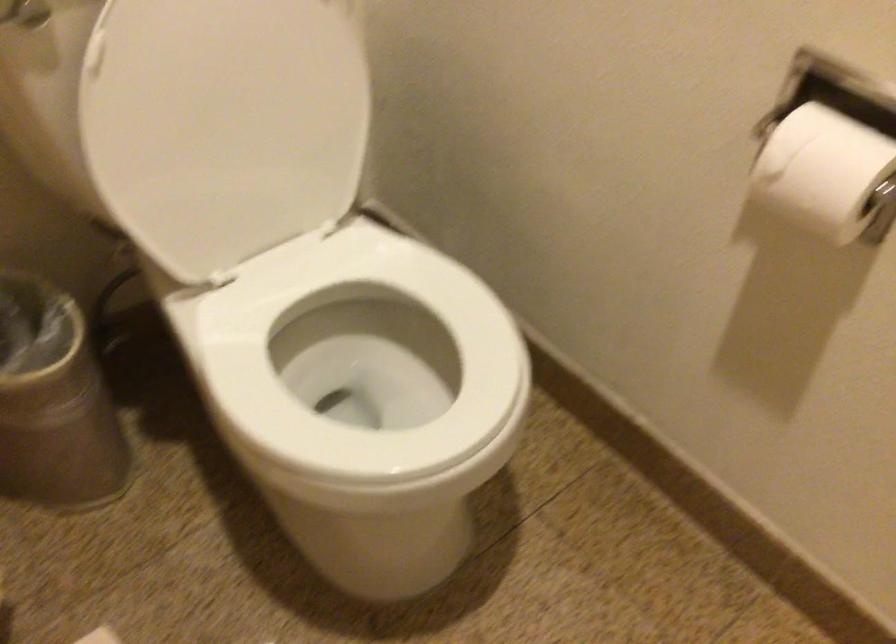
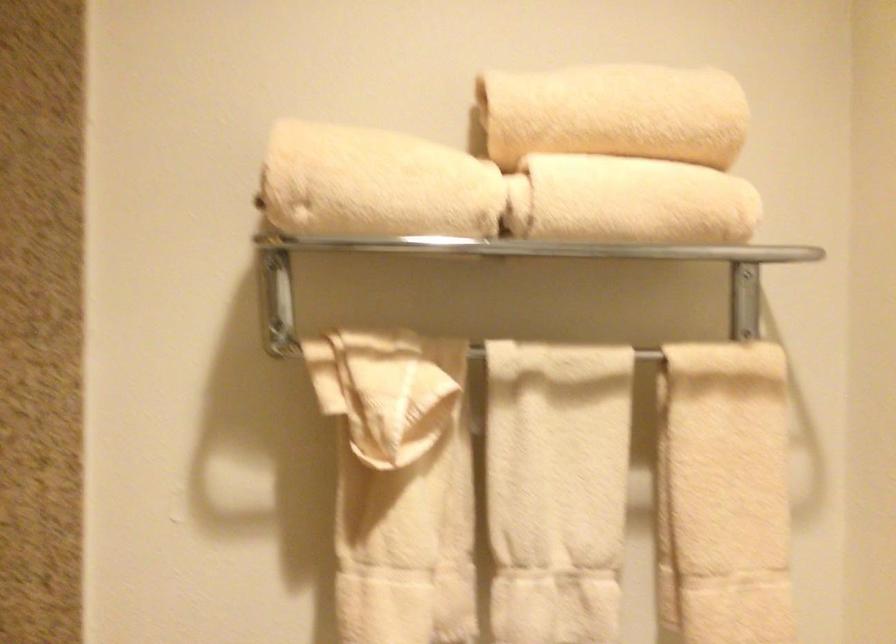
First-person continuous shooting, in which direction is the camera rotating?

The camera's rotation is toward left-up.